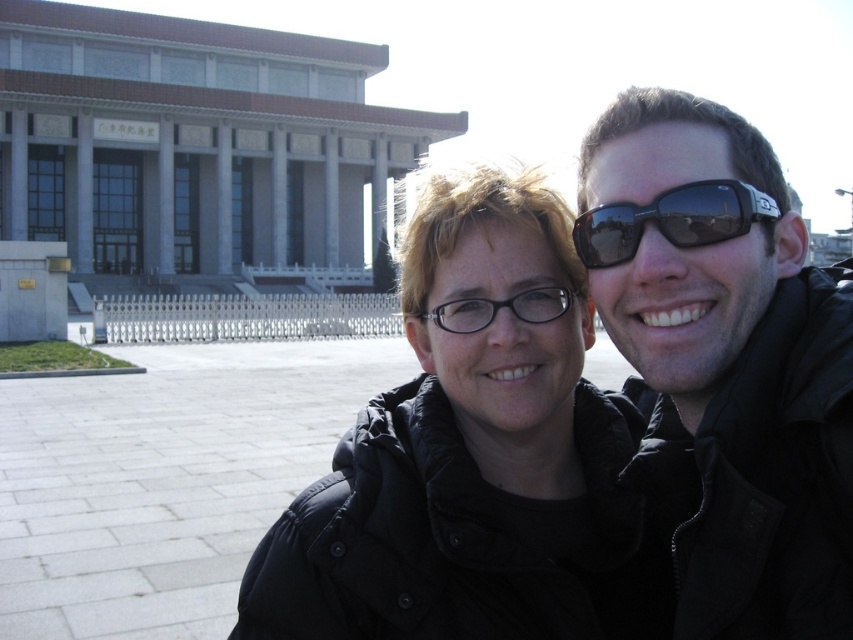
Is black matte jacket at center below black matte jacket at upper right?

Yes.

Is black matte jacket at center thinner than black matte jacket at upper right?

Incorrect, black matte jacket at center's width is not less than black matte jacket at upper right's.

Where is `black matte jacket at center`? This screenshot has height=640, width=853. black matte jacket at center is located at coordinates (469, 458).

This screenshot has height=640, width=853. What are the coordinates of `black matte jacket at center` in the screenshot? It's located at (469, 458).

Which is behind, point (846, 605) or point (508, 298)?

Point (508, 298)

Is point (801, 355) positioned behind point (491, 314)?

No.

At what (x,y) coordinates should I click in order to perform the action: click on black matte jacket at upper right. Please return your answer as a coordinate pair (x, y). The width and height of the screenshot is (853, 640). Looking at the image, I should click on (724, 364).

Is black matte jacket at center below sunglasses at center?

Indeed, black matte jacket at center is positioned under sunglasses at center.

Measure the distance from black matte jacket at center to sunglasses at center.

black matte jacket at center and sunglasses at center are 33.25 inches apart from each other.

Which is in front, point (495, 320) or point (595, 230)?

Point (595, 230) is in front.

You are a GUI agent. You are given a task and a screenshot of the screen. Output one action in this format:
    pyautogui.click(x=<x>, y=<y>)
    Task: Click on the black matte jacket at center
    
    Given the screenshot: What is the action you would take?
    pyautogui.click(x=469, y=458)